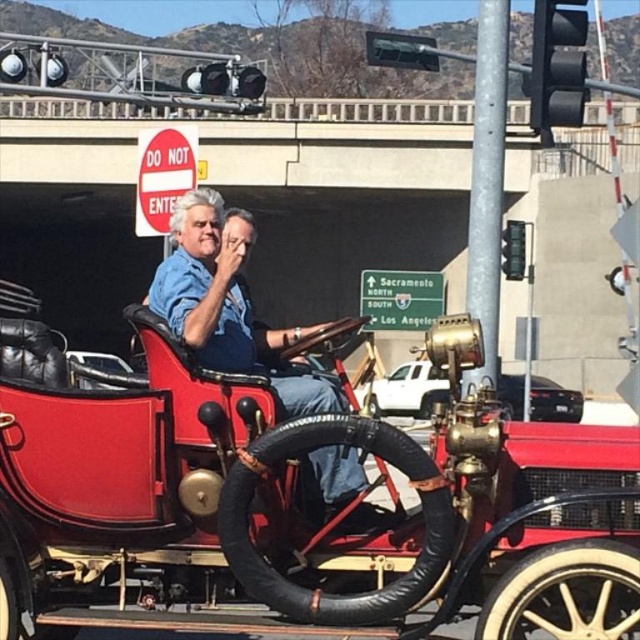
Find the location of a particular element. This screenshot has height=640, width=640. concrete bridge at upper center is located at coordinates (369, 109).

This screenshot has width=640, height=640. What do you see at coordinates (369, 109) in the screenshot?
I see `concrete bridge at upper center` at bounding box center [369, 109].

The image size is (640, 640). Describe the element at coordinates (369, 109) in the screenshot. I see `concrete bridge at upper center` at that location.

Find the location of a particular element. This screenshot has height=640, width=640. concrete bridge at upper center is located at coordinates pyautogui.click(x=369, y=109).

Does matte blue shirt at center have a greater height compared to concrete bridge at upper center?

No.

Describe the element at coordinates (228, 307) in the screenshot. This screenshot has height=640, width=640. I see `matte blue shirt at center` at that location.

You are a GUI agent. You are given a task and a screenshot of the screen. Output one action in this format:
    pyautogui.click(x=<x>, y=<y>)
    Task: Click on the matte blue shirt at center
    This screenshot has width=640, height=640.
    Given the screenshot: What is the action you would take?
    pyautogui.click(x=228, y=307)

How distant is matte blue shirt at center from red leather seat at center?

matte blue shirt at center is 6.69 meters away from red leather seat at center.

Does matte blue shirt at center appear on the left side of red leather seat at center?

Incorrect, matte blue shirt at center is not on the left side of red leather seat at center.

The width and height of the screenshot is (640, 640). Find the location of `matte blue shirt at center`. matte blue shirt at center is located at coordinates (228, 307).

Where is `matte blue shirt at center`? matte blue shirt at center is located at coordinates (228, 307).